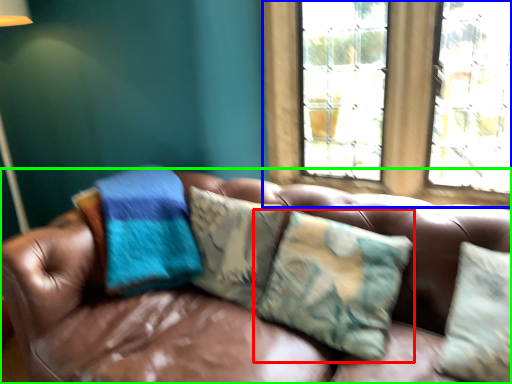
Question: Which object is the closest to the pillow (highlighted by a red box)? Choose among these: window (highlighted by a blue box) or studio couch (highlighted by a green box).

Choices:
 (A) window
 (B) studio couch

Answer: (B)